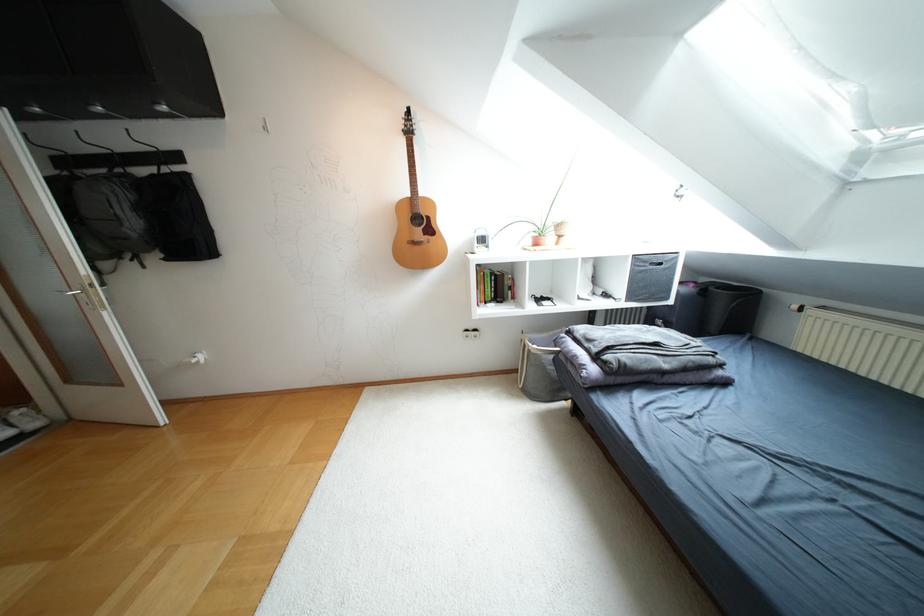
Where would you pull the storage box handle? Please return your answer as a coordinate pair (x, y).

(523, 360)